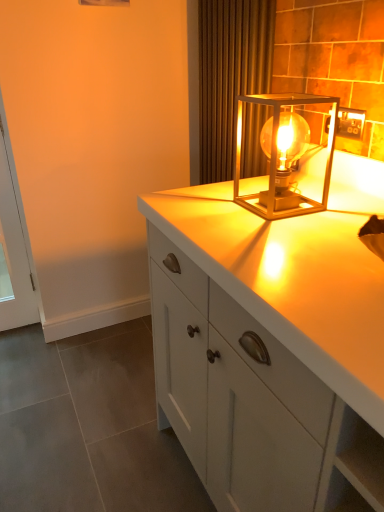
Question: In terms of size, does white glass screen door at left appear bigger or smaller than brown textured curtain at upper center?

Choices:
 (A) small
 (B) big

Answer: (A)

Question: In the image, is white glass screen door at left positioned in front of or behind brown textured curtain at upper center?

Choices:
 (A) behind
 (B) front

Answer: (A)

Question: Considering the real-world distances, which object is farthest from the brown textured curtain at upper center?

Choices:
 (A) metallic gold lamp at upper right
 (B) white glossy cabinet at center
 (C) white glass screen door at left
 (D) metallic gold outlet at upper right

Answer: (C)

Question: Which of these objects is positioned closest to the metallic gold outlet at upper right?

Choices:
 (A) white glossy cabinet at center
 (B) white glass screen door at left
 (C) brown textured curtain at upper center
 (D) metallic gold lamp at upper right

Answer: (D)